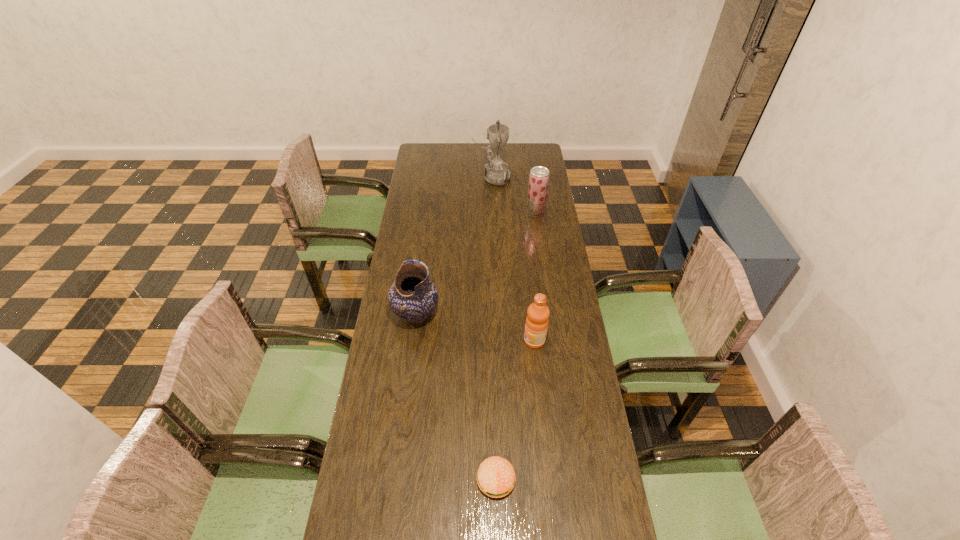
Where is `the tallest object`? The image size is (960, 540). the tallest object is located at coordinates (496, 172).

I want to click on award, so click(496, 172).

Locate an element on the screen. This screenshot has width=960, height=540. the second farthest object is located at coordinates (539, 176).

Find the location of a particular element. The image size is (960, 540). the nearer fruit juice is located at coordinates (536, 325).

Image resolution: width=960 pixels, height=540 pixels. I want to click on the leftmost object, so click(x=413, y=296).

The width and height of the screenshot is (960, 540). What are the coordinates of `patty` in the screenshot? It's located at (496, 477).

This screenshot has height=540, width=960. I want to click on the shortest object, so click(496, 477).

Where is `vacant region located 0.130m on the side with emblem of the farthest object`? Image resolution: width=960 pixels, height=540 pixels. vacant region located 0.130m on the side with emblem of the farthest object is located at coordinates (447, 178).

Identify the location of free space located 0.170m on the side with emblem of the farthest object. The width and height of the screenshot is (960, 540). (440, 178).

The height and width of the screenshot is (540, 960). I want to click on vacant space located 0.100m on the side with emblem of the farthest object, so click(x=453, y=178).